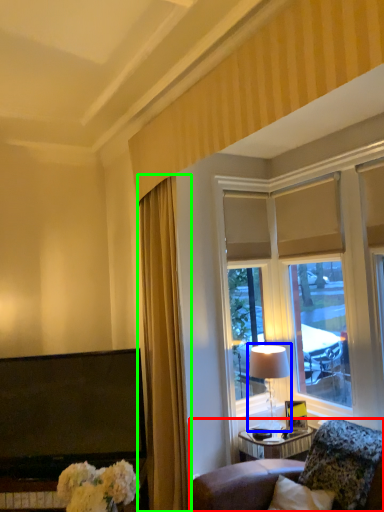
Question: Which object is the closest to the furniture (highlighted by a red box)? Choose among these: table lamp (highlighted by a blue box) or curtain (highlighted by a green box).

Choices:
 (A) table lamp
 (B) curtain

Answer: (A)